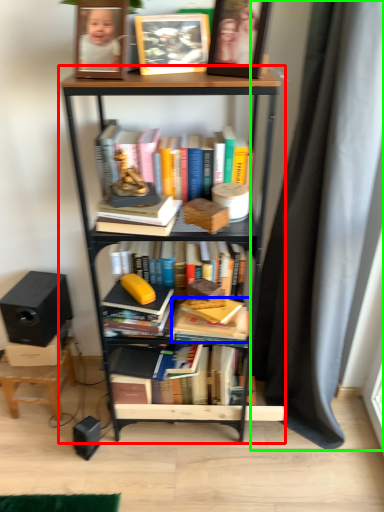
Question: Which is farther away from bookcase (highlighted by a red box)? book (highlighted by a blue box) or curtain (highlighted by a green box)?

Choices:
 (A) book
 (B) curtain

Answer: (A)